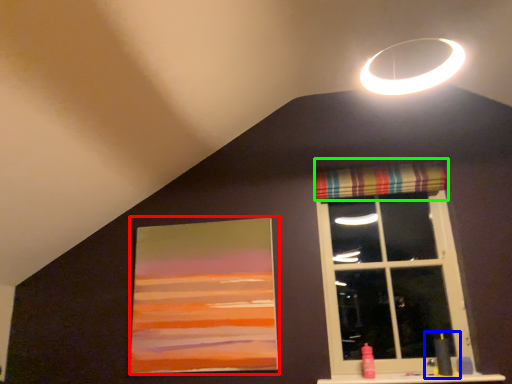
Question: Which object is positioned closest to picture frame (highlighted by a red box)? Select from sink (highlighted by a blue box) and curtain (highlighted by a green box).

Choices:
 (A) sink
 (B) curtain

Answer: (B)